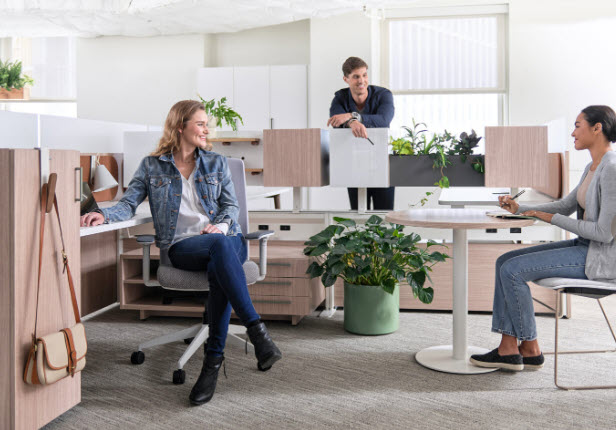
I want to click on plant, so click(x=363, y=269).